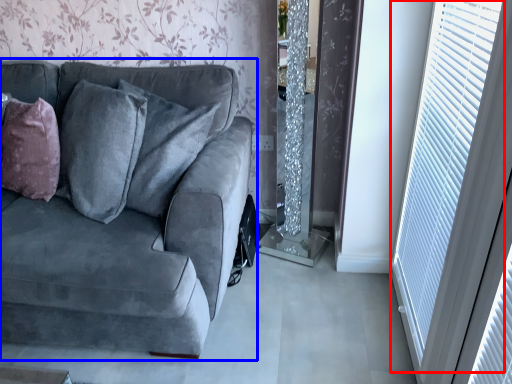
Question: Which of the following is the farthest to the observer, window (highlighted by a red box) or studio couch (highlighted by a blue box)?

Choices:
 (A) window
 (B) studio couch

Answer: (A)